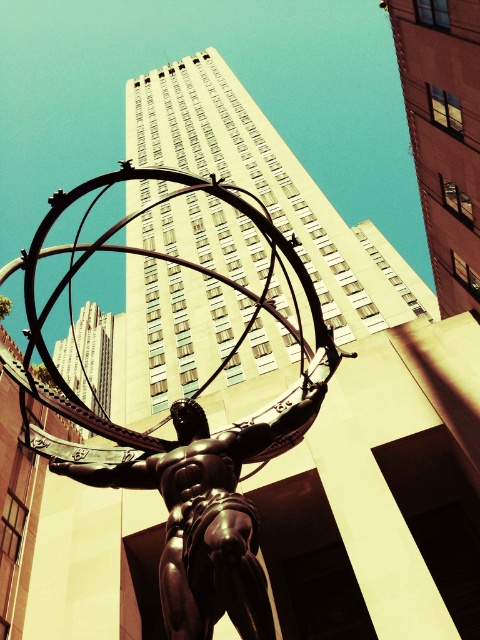
Is polished bronze statue at center further to camera compared to shiny bronze statue at center?

Yes, it is.

At what (x,y) coordinates should I click in order to perform the action: click on polished bronze statue at center. Please return your answer as a coordinate pair (x, y). The image size is (480, 640). Looking at the image, I should click on (184, 426).

At what (x,y) coordinates should I click in order to perform the action: click on polished bronze statue at center. Please return your answer as a coordinate pair (x, y). Image resolution: width=480 pixels, height=640 pixels. Looking at the image, I should click on (184, 426).